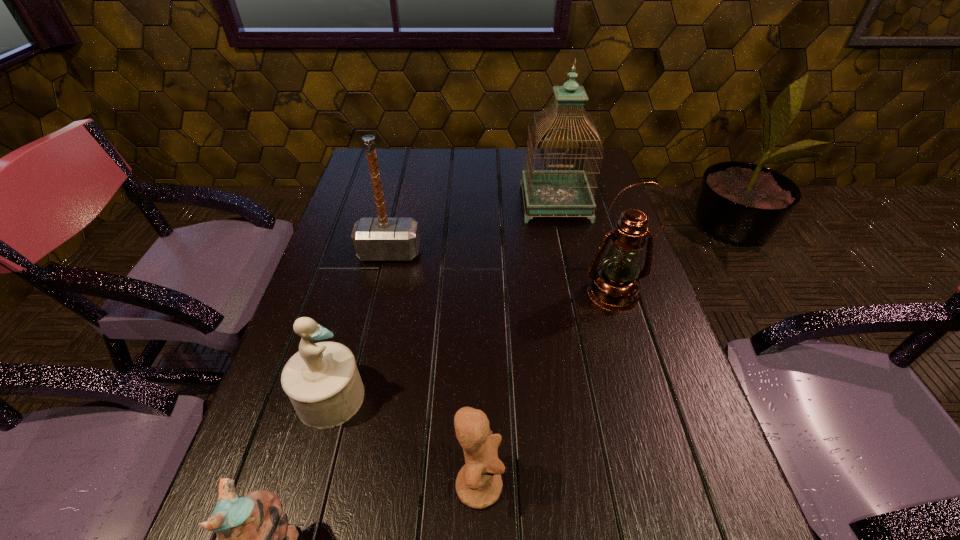
Locate an element on the screen. Image resolution: width=960 pixels, height=540 pixels. free space located 0.110m at the beak of the third nearest object is located at coordinates (420, 397).

You are a GUI agent. You are given a task and a screenshot of the screen. Output one action in this format:
    pyautogui.click(x=<x>, y=<y>)
    Task: Click on the vacant region located 0.270m on the front-facing side of the fourth object from left to right
    The width and height of the screenshot is (960, 540).
    Given the screenshot: What is the action you would take?
    pyautogui.click(x=663, y=484)

Identify the location of object positioned at the far edge. (553, 192).

Where is `hammer that is positioned at the left edge`? This screenshot has width=960, height=540. hammer that is positioned at the left edge is located at coordinates (374, 239).

I want to click on figurine that is positioned at the left edge, so click(x=322, y=381).

The height and width of the screenshot is (540, 960). I want to click on birdcage that is positioned at the right edge, so click(553, 192).

Identify the location of oil lamp present at the right edge. This screenshot has height=540, width=960. (615, 285).

I want to click on object that is at the far right corner, so click(x=553, y=192).

Locate an element on the screen. free space at the far edge is located at coordinates (543, 160).

The height and width of the screenshot is (540, 960). In the image, there is a desktop. Find the location of `vacant space at the left edge`. vacant space at the left edge is located at coordinates (244, 455).